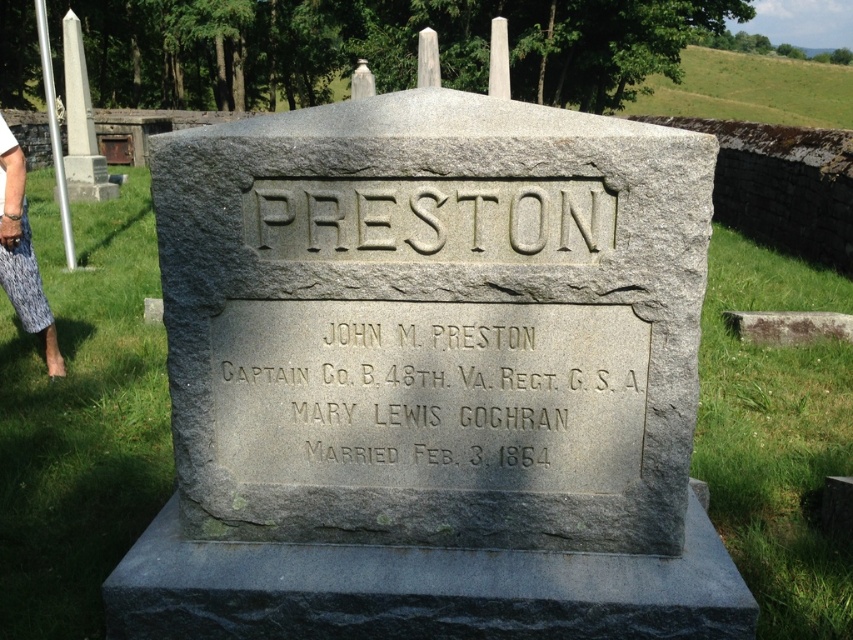
Question: Where is gray stone monument at center located in relation to gray stone engraving at center in the image?

Choices:
 (A) left
 (B) right

Answer: (A)

Question: Does gray stone monument at center appear over white printed pants at left?

Choices:
 (A) yes
 (B) no

Answer: (B)

Question: Which of the following is the closest to the observer?

Choices:
 (A) white printed pants at left
 (B) gold engraved text at center
 (C) gray stone engraving at center
 (D) gray stone monument at center

Answer: (D)

Question: Which of the following is the closest to the observer?

Choices:
 (A) white printed pants at left
 (B) gray stone engraving at center

Answer: (B)

Question: Which point is closer to the camera taking this photo?

Choices:
 (A) (426, 458)
 (B) (405, 257)
 (C) (585, 168)

Answer: (C)

Question: Considering the relative positions of gold engraved text at center and gray stone engraving at center in the image provided, where is gold engraved text at center located with respect to gray stone engraving at center?

Choices:
 (A) below
 (B) above

Answer: (A)